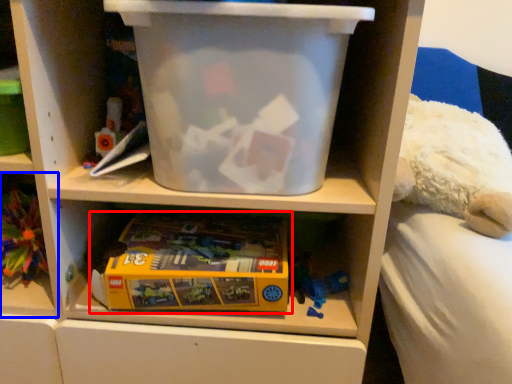
Question: Which object appears closest to the camera in this image, toy (highlighted by a red box) or shelf (highlighted by a blue box)?

Choices:
 (A) toy
 (B) shelf

Answer: (A)